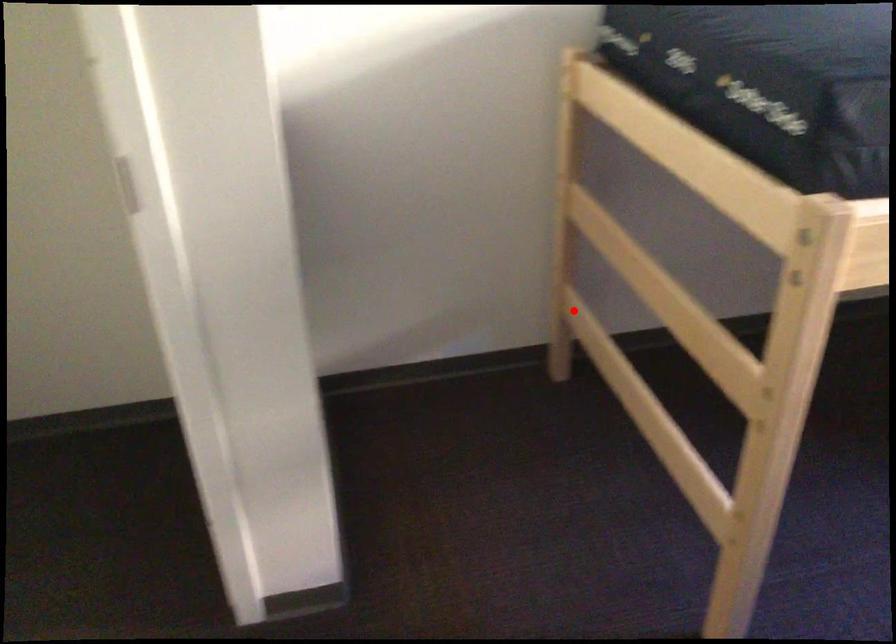
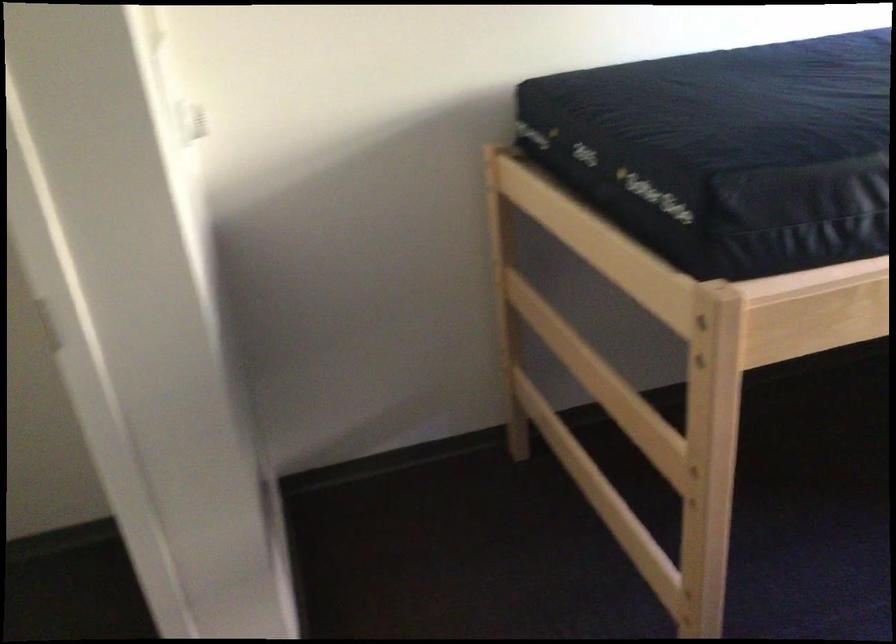
In the second image, find the point that corresponds to the highlighted location in the first image.

(524, 392)